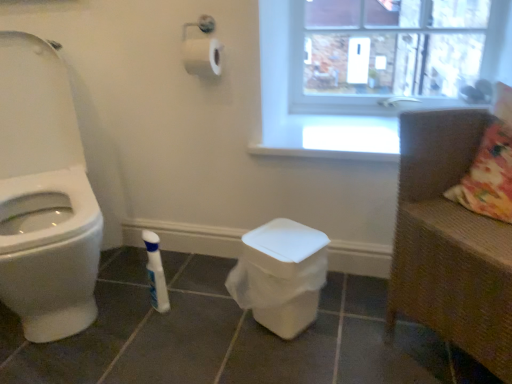
Measure the distance between point (x=506, y=265) and camera.

The distance of point (x=506, y=265) from camera is 31.65 inches.

I want to click on transparent plastic window screen at upper right, so click(x=392, y=46).

The image size is (512, 384). Describe the element at coordinates (392, 46) in the screenshot. I see `transparent plastic window screen at upper right` at that location.

The image size is (512, 384). What do you see at coordinates (156, 273) in the screenshot?
I see `white glossy bottle at lower center` at bounding box center [156, 273].

Identify the location of brown woven armchair at right. (450, 243).

Can you confirm if brown woven armchair at right is taller than transparent plastic window screen at upper right?

Yes, brown woven armchair at right is taller than transparent plastic window screen at upper right.

Looking at their sizes, would you say brown woven armchair at right is wider or thinner than transparent plastic window screen at upper right?

Considering their sizes, brown woven armchair at right looks broader than transparent plastic window screen at upper right.

Who is smaller, brown woven armchair at right or transparent plastic window screen at upper right?

transparent plastic window screen at upper right.

From the image's perspective, would you say brown woven armchair at right is positioned over transparent plastic window screen at upper right?

No, from the image's perspective, brown woven armchair at right is not on top of transparent plastic window screen at upper right.

Considering the relative positions of white glossy bottle at lower center and transparent plastic window screen at upper right in the image provided, is white glossy bottle at lower center to the right of transparent plastic window screen at upper right from the viewer's perspective?

In fact, white glossy bottle at lower center is to the left of transparent plastic window screen at upper right.

Who is smaller, white glossy bottle at lower center or transparent plastic window screen at upper right?

white glossy bottle at lower center.

Is white glossy bottle at lower center completely or partially outside of transparent plastic window screen at upper right?

Yes, white glossy bottle at lower center is located beyond the bounds of transparent plastic window screen at upper right.

Which object is closer to the camera, white glossy bottle at lower center or transparent plastic window screen at upper right?

white glossy bottle at lower center is in front.

In order to click on window screen above the brown woven armchair at right (from the image's perspective) in this screenshot , I will do `click(392, 46)`.

Which is correct: transparent plastic window screen at upper right is inside brown woven armchair at right, or outside of it?

transparent plastic window screen at upper right is not enclosed by brown woven armchair at right.

From the image's perspective, which one is positioned higher, transparent plastic window screen at upper right or brown woven armchair at right?

transparent plastic window screen at upper right.

From a real-world perspective, is transparent plastic window screen at upper right positioned over brown woven armchair at right based on gravity?

Yes, from a real-world perspective, transparent plastic window screen at upper right is above brown woven armchair at right.

At what (x,y) coordinates should I click in order to perform the action: click on toiletry lying below the brown woven armchair at right (from the image's perspective). Please return your answer as a coordinate pair (x, y). Looking at the image, I should click on (156, 273).

Is white glossy bottle at lower center bigger or smaller than brown woven armchair at right?

white glossy bottle at lower center is smaller than brown woven armchair at right.

From a real-world perspective, is white glossy bottle at lower center above or below brown woven armchair at right?

white glossy bottle at lower center is situated lower than brown woven armchair at right in the real world.

Is white glossy bottle at lower center at the right side of brown woven armchair at right?

No.

Does brown woven armchair at right touch white glossy bottle at lower center?

They are not placed beside each other.

Based on the photo, considering the relative sizes of brown woven armchair at right and white glossy bottle at lower center in the image provided, is brown woven armchair at right thinner than white glossy bottle at lower center?

No, brown woven armchair at right is not thinner than white glossy bottle at lower center.

How many degrees apart are the facing directions of brown woven armchair at right and white glossy bottle at lower center?

They differ by 86 degrees in their facing directions.

This screenshot has width=512, height=384. I want to click on armchair that is above the white glossy bottle at lower center (from the image's perspective), so click(450, 243).

The image size is (512, 384). Find the location of `window screen behind the white glossy bottle at lower center`. window screen behind the white glossy bottle at lower center is located at coordinates (392, 46).

From a real-world perspective, relative to white glossy bottle at lower center, is transparent plastic window screen at upper right vertically above or below?

From a real-world perspective, transparent plastic window screen at upper right is physically above white glossy bottle at lower center.

Which object is positioned more to the left, transparent plastic window screen at upper right or white glossy bottle at lower center?

white glossy bottle at lower center.

From the image's perspective, between transparent plastic window screen at upper right and white glossy bottle at lower center, which one is located above?

transparent plastic window screen at upper right appears higher in the image.

Find the location of a particular element. Image resolution: width=512 pixels, height=384 pixels. window screen that appears behind the brown woven armchair at right is located at coordinates (392, 46).

Image resolution: width=512 pixels, height=384 pixels. What are the coordinates of `window screen located on the right of white glossy bottle at lower center` in the screenshot? It's located at (392, 46).

From the image, which object appears to be nearer to brown woven armchair at right, white glossy bottle at lower center or transparent plastic window screen at upper right?

transparent plastic window screen at upper right is positioned closer to the anchor brown woven armchair at right.

Estimate the real-world distances between objects in this image. Which object is closer to white glossy bottle at lower center, transparent plastic window screen at upper right or brown woven armchair at right?

brown woven armchair at right is closer to white glossy bottle at lower center.

From the image, which object appears to be farther from brown woven armchair at right, transparent plastic window screen at upper right or white glossy bottle at lower center?

white glossy bottle at lower center is positioned further to the anchor brown woven armchair at right.

Which object lies nearer to the anchor point white glossy bottle at lower center, brown woven armchair at right or transparent plastic window screen at upper right?

brown woven armchair at right lies closer to white glossy bottle at lower center than the other object.

Looking at the image, which one is located further to transparent plastic window screen at upper right, white glossy bottle at lower center or brown woven armchair at right?

The object further to transparent plastic window screen at upper right is white glossy bottle at lower center.

From the image, which object appears to be nearer to transparent plastic window screen at upper right, brown woven armchair at right or white glossy bottle at lower center?

brown woven armchair at right lies closer to transparent plastic window screen at upper right than the other object.

At what (x,y) coordinates should I click in order to perform the action: click on window screen between white glossy bottle at lower center and brown woven armchair at right from left to right. Please return your answer as a coordinate pair (x, y). This screenshot has width=512, height=384. Looking at the image, I should click on (392, 46).